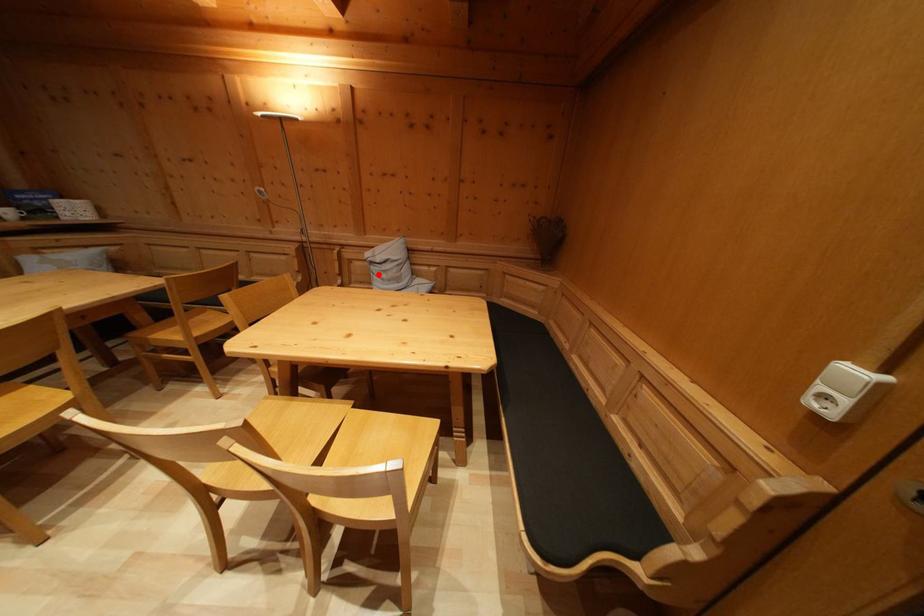
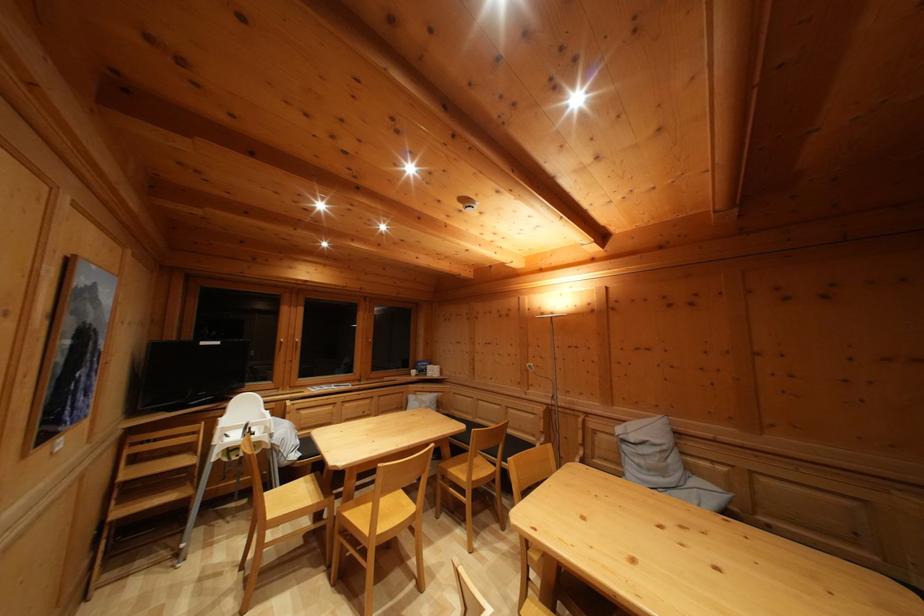
Question: A red point is marked in image1. In image2, is the corresponding 3D point closer to the camera or farther? Reply with the corresponding letter.

Choices:
 (A) The corresponding 3D point is closer.
 (B) The corresponding 3D point is farther.

Answer: (B)